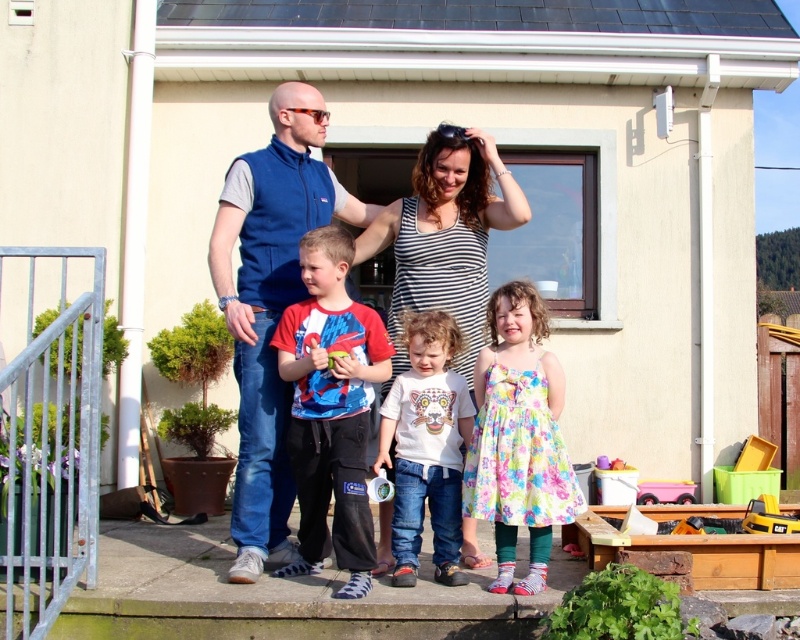
Question: Does blue fleece vest at center appear under red cotton t-shirt at center?

Choices:
 (A) yes
 (B) no

Answer: (B)

Question: Which point is farther to the camera?

Choices:
 (A) striped tank top at center
 (B) red cotton t-shirt at center
 (C) matte blue vest at upper left
 (D) blue fleece vest at center

Answer: (C)

Question: Based on their relative distances, which object is farther from the matte blue vest at upper left?

Choices:
 (A) red cotton t-shirt at center
 (B) striped tank top at center
 (C) white cotton t-shirt at center

Answer: (A)

Question: Is matte blue vest at upper left to the right of striped tank top at center from the viewer's perspective?

Choices:
 (A) yes
 (B) no

Answer: (B)

Question: Is red cotton t-shirt at center thinner than white cotton t-shirt at center?

Choices:
 (A) yes
 (B) no

Answer: (B)

Question: Which of the following is the closest to the observer?

Choices:
 (A) (438, 513)
 (B) (230, 227)
 (C) (425, 209)

Answer: (A)